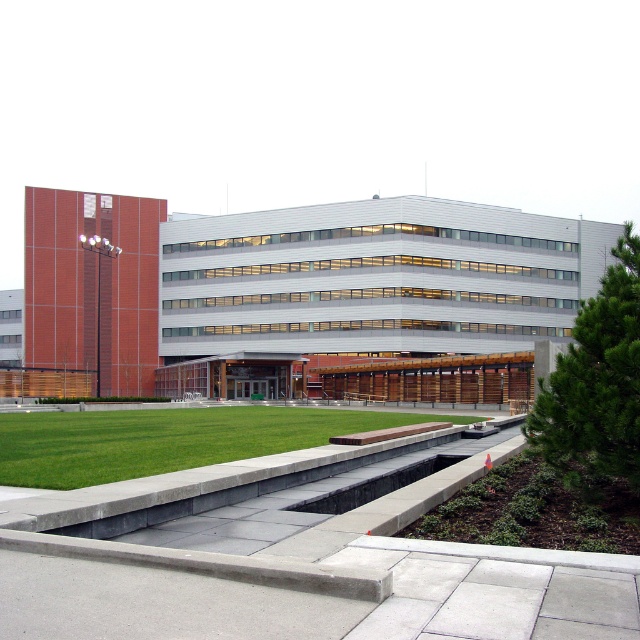
Does matte brick building at left have a lesser height compared to green grass at lower center?

Incorrect, matte brick building at left's height does not fall short of green grass at lower center's.

Between matte brick building at left and green grass at lower center, which one appears on the left side from the viewer's perspective?

green grass at lower center

Who is more distant from viewer, (353, 252) or (120, 440)?

The point (353, 252) is behind.

At what (x,y) coordinates should I click in order to perform the action: click on matte brick building at left. Please return your answer as a coordinate pair (x, y). The width and height of the screenshot is (640, 640). Looking at the image, I should click on (294, 282).

Find the location of a particular element. The image size is (640, 640). gray concrete pavement at lower center is located at coordinates (314, 600).

Between gray concrete pavement at lower center and green grass at lower center, which one appears on the left side from the viewer's perspective?

green grass at lower center is more to the left.

Where is `gray concrete pavement at lower center`? The width and height of the screenshot is (640, 640). gray concrete pavement at lower center is located at coordinates (314, 600).

You are a GUI agent. You are given a task and a screenshot of the screen. Output one action in this format:
    pyautogui.click(x=<x>, y=<y>)
    Task: Click on the gray concrete pavement at lower center
    Image resolution: width=640 pixels, height=640 pixels.
    Given the screenshot: What is the action you would take?
    pyautogui.click(x=314, y=600)

In order to click on matte brick building at left in this screenshot , I will do `click(294, 282)`.

Is point (388, 282) closer to camera compared to point (493, 632)?

No, it is behind (493, 632).

Who is more forward, (x=125, y=378) or (x=195, y=628)?

Positioned in front is point (x=195, y=628).

The image size is (640, 640). I want to click on matte brick building at left, so pos(294,282).